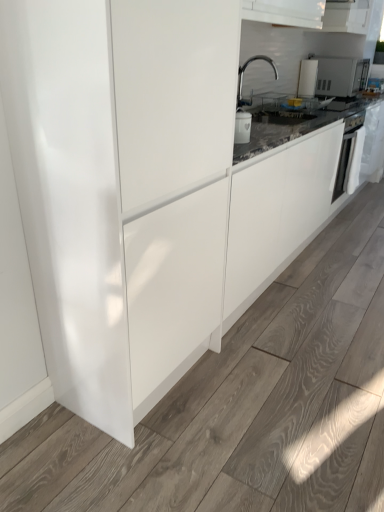
Question: Is white glossy microwave at upper right far away from white glossy microwave at upper right?

Choices:
 (A) no
 (B) yes

Answer: (A)

Question: From a real-world perspective, does white glossy microwave at upper right sit lower than white glossy microwave at upper right?

Choices:
 (A) no
 (B) yes

Answer: (A)

Question: Is the depth of white glossy microwave at upper right greater than that of white glossy microwave at upper right?

Choices:
 (A) yes
 (B) no

Answer: (B)

Question: From the image's perspective, would you say white glossy microwave at upper right is shown under white glossy microwave at upper right?

Choices:
 (A) yes
 (B) no

Answer: (B)

Question: Is white glossy microwave at upper right at the right side of white glossy microwave at upper right?

Choices:
 (A) yes
 (B) no

Answer: (A)

Question: Relative to white glossy microwave at upper right, is white glossy oven at right in front or behind?

Choices:
 (A) front
 (B) behind

Answer: (A)

Question: Is white glossy oven at right wider or thinner than white glossy microwave at upper right?

Choices:
 (A) wide
 (B) thin

Answer: (B)

Question: Is point (352, 147) closer or farther from the camera than point (309, 56)?

Choices:
 (A) farther
 (B) closer

Answer: (B)

Question: From the image's perspective, relative to white glossy microwave at upper right, is white glossy oven at right above or below?

Choices:
 (A) below
 (B) above

Answer: (A)

Question: In terms of height, does glossy white cabinet at center look taller or shorter compared to polished chrome faucet at upper center?

Choices:
 (A) short
 (B) tall

Answer: (B)

Question: Does point 109,91 appear closer or farther from the camera than point 238,89?

Choices:
 (A) farther
 (B) closer

Answer: (B)

Question: Based on their positions, is glossy white cabinet at center located to the left or right of polished chrome faucet at upper center?

Choices:
 (A) left
 (B) right

Answer: (A)

Question: From the image's perspective, is glossy white cabinet at center positioned above or below polished chrome faucet at upper center?

Choices:
 (A) above
 (B) below

Answer: (B)

Question: Is white glossy microwave at upper right inside or outside of white glossy microwave at upper right?

Choices:
 (A) inside
 (B) outside

Answer: (B)

Question: Based on their sizes in the image, would you say white glossy microwave at upper right is bigger or smaller than white glossy microwave at upper right?

Choices:
 (A) big
 (B) small

Answer: (B)